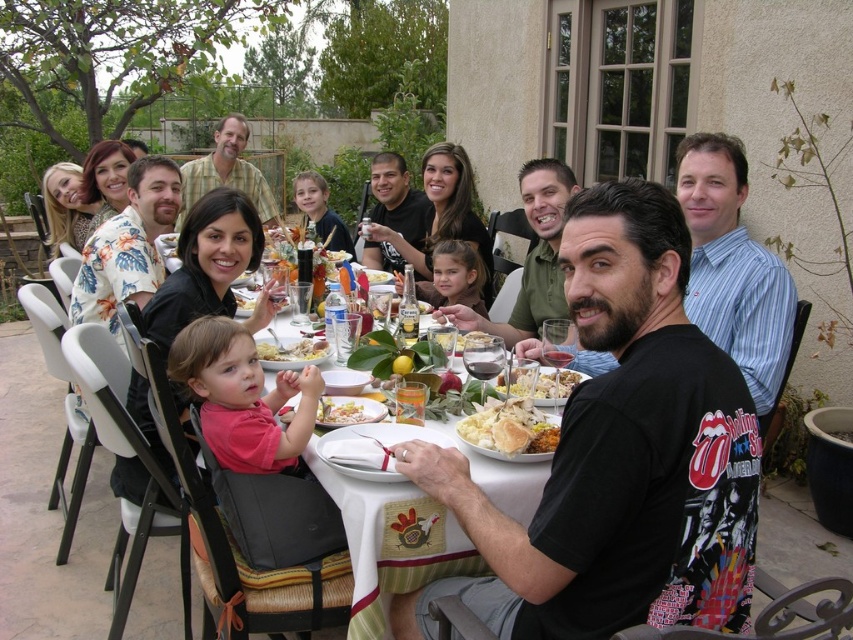
Is point (677, 520) farther from viewer compared to point (514, 433)?

No, it is not.

This screenshot has height=640, width=853. Describe the element at coordinates (618, 452) in the screenshot. I see `matte black t-shirt at center` at that location.

Where is `matte black t-shirt at center`? The image size is (853, 640). matte black t-shirt at center is located at coordinates (618, 452).

Between matte black t-shirt at center and yellow matte plate at center, which one is positioned higher?

Positioned higher is yellow matte plate at center.

Locate an element on the screen. matte black t-shirt at center is located at coordinates (618, 452).

Does yellowish matte plate at center appear under white porcelain plate at center?

Actually, yellowish matte plate at center is above white porcelain plate at center.

Is yellowish matte plate at center further to camera compared to white porcelain plate at center?

Yes.

The height and width of the screenshot is (640, 853). What do you see at coordinates (292, 349) in the screenshot?
I see `yellowish matte plate at center` at bounding box center [292, 349].

The image size is (853, 640). Identify the location of yellowish matte plate at center. (292, 349).